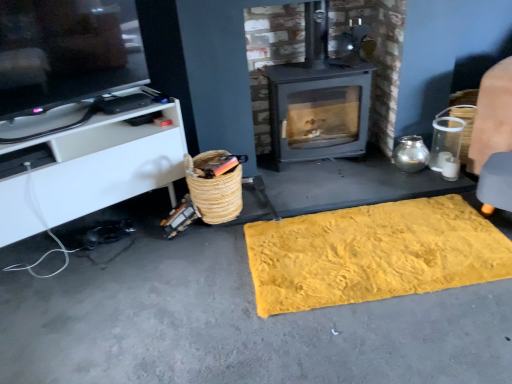
Describe the element at coordinates (237, 325) in the screenshot. This screenshot has height=384, width=512. I see `yellow textured rug at lower center` at that location.

The image size is (512, 384). Describe the element at coordinates (373, 253) in the screenshot. I see `yellow textured mat at center` at that location.

Measure the distance between point (421, 276) and camera.

Point (421, 276) and camera are 5.57 feet apart from each other.

In order to face woven straw basket at lower left, should I rotate leftwards or rightwards?

It's best to rotate left around 5.407 degrees.

What are the coordinates of `white matte cabinet at left` in the screenshot? It's located at (106, 162).

Where is `yellow textured rug at lower center`? yellow textured rug at lower center is located at coordinates (237, 325).

Considering the positions of objects matte gray wood burning stove at center and woven straw basket at lower left in the image provided, who is more to the right, matte gray wood burning stove at center or woven straw basket at lower left?

matte gray wood burning stove at center.

This screenshot has height=384, width=512. Find the location of `basket in front of the matte gray wood burning stove at center`. basket in front of the matte gray wood burning stove at center is located at coordinates (214, 189).

Is matte gray wood burning stove at center positioned with its back to woven straw basket at lower left?

No, matte gray wood burning stove at center is not facing the opposite direction of woven straw basket at lower left.

Who is smaller, matte gray wood burning stove at center or woven straw basket at lower left?

With smaller size is woven straw basket at lower left.

Does point (2, 103) come in front of point (344, 59)?

Yes, point (2, 103) is in front of point (344, 59).

Locate an element on the screen. Image resolution: width=512 pixels, height=384 pixels. television below the matte gray wood burning stove at center (from the image's perspective) is located at coordinates (65, 52).

Locate an element on the screen. basket behind the matte black tv at upper left is located at coordinates (214, 189).

Could you tell me if matte black tv at upper left is turned towards woven straw basket at lower left?

No, matte black tv at upper left is not oriented towards woven straw basket at lower left.

Considering the sizes of objects matte black tv at upper left and woven straw basket at lower left in the image provided, who is smaller, matte black tv at upper left or woven straw basket at lower left?

woven straw basket at lower left is smaller.

From a real-world perspective, who is located higher, matte black tv at upper left or woven straw basket at lower left?

In real-world perspective, matte black tv at upper left is above.

From a real-world perspective, is woven straw basket at lower left physically located above or below matte black tv at upper left?

woven straw basket at lower left is situated lower than matte black tv at upper left in the real world.

Looking at this image, from the image's perspective, is woven straw basket at lower left above or below matte black tv at upper left?

From the image's perspective, woven straw basket at lower left appears below matte black tv at upper left.

Is point (226, 219) positioned in front of point (27, 26)?

No, (226, 219) is further to viewer.

Which of these two, woven straw basket at lower left or matte black tv at upper left, stands shorter?

woven straw basket at lower left is shorter.

From the picture: Is white matte cabinet at left taller than woven straw basket at lower left?

Correct, white matte cabinet at left is much taller as woven straw basket at lower left.

Considering the relative positions of white matte cabinet at left and woven straw basket at lower left in the image provided, is white matte cabinet at left to the left or to the right of woven straw basket at lower left?

Based on their positions, white matte cabinet at left is located to the left of woven straw basket at lower left.

Is white matte cabinet at left bigger or smaller than woven straw basket at lower left?

Clearly, white matte cabinet at left is larger in size than woven straw basket at lower left.

Is point (25, 176) closer or farther from the camera than point (213, 206)?

Point (25, 176).

Which object is positioned more to the left, white matte cabinet at left or yellow textured mat at center?

white matte cabinet at left is more to the left.

Is yellow textured mat at center a part of white matte cabinet at left?

No, yellow textured mat at center is located outside of white matte cabinet at left.

Locate an element on the screen. The image size is (512, 384). mat on the right side of white matte cabinet at left is located at coordinates (373, 253).

From the image's perspective, which is below, white matte cabinet at left or yellow textured mat at center?

yellow textured mat at center appears lower in the image.

From a real-world perspective, is matte gray wood burning stove at center positioned under white matte cabinet at left based on gravity?

Incorrect, from a real-world perspective, matte gray wood burning stove at center is higher than white matte cabinet at left.

Considering the sizes of matte gray wood burning stove at center and white matte cabinet at left in the image, is matte gray wood burning stove at center taller or shorter than white matte cabinet at left?

Clearly, matte gray wood burning stove at center is taller compared to white matte cabinet at left.

Can you tell me how much matte gray wood burning stove at center and white matte cabinet at left differ in facing direction?

32.4 degrees.

Who is more distant, matte gray wood burning stove at center or white matte cabinet at left?

matte gray wood burning stove at center is behind.

Where is `wood burning stove on the right of woven straw basket at lower left`? The image size is (512, 384). wood burning stove on the right of woven straw basket at lower left is located at coordinates (320, 96).

Image resolution: width=512 pixels, height=384 pixels. Identify the location of wood burning stove behind the matte black tv at upper left. (320, 96).

Looking at the image, which one is located further to white matte cabinet at left, yellow textured mat at center or yellow textured rug at lower center?

The object further to white matte cabinet at left is yellow textured mat at center.

When comparing their distances from yellow textured mat at center, does yellow textured rug at lower center or white matte cabinet at left seem closer?

Based on the image, yellow textured rug at lower center appears to be nearer to yellow textured mat at center.

Which object lies nearer to the anchor point matte black tv at upper left, matte gray wood burning stove at center or white matte cabinet at left?

white matte cabinet at left is positioned closer to the anchor matte black tv at upper left.

Which object lies nearer to the anchor point matte black tv at upper left, yellow textured mat at center or yellow textured rug at lower center?

Based on the image, yellow textured rug at lower center appears to be nearer to matte black tv at upper left.

When comparing their distances from white matte cabinet at left, does yellow textured mat at center or woven straw basket at lower left seem further?

yellow textured mat at center is further to white matte cabinet at left.

Based on their spatial positions, is yellow textured rug at lower center or woven straw basket at lower left closer to white matte cabinet at left?

Based on the image, woven straw basket at lower left appears to be nearer to white matte cabinet at left.

Which object lies nearer to the anchor point matte gray wood burning stove at center, matte black tv at upper left or woven straw basket at lower left?

woven straw basket at lower left.

Estimate the real-world distances between objects in this image. Which object is further from yellow textured mat at center, matte gray wood burning stove at center or yellow textured rug at lower center?

matte gray wood burning stove at center.

The image size is (512, 384). Identify the location of basket located between matte black tv at upper left and yellow textured rug at lower center in the left-right direction. tap(214, 189).

I want to click on television between white matte cabinet at left and yellow textured rug at lower center in the horizontal direction, so click(x=65, y=52).

This screenshot has height=384, width=512. I want to click on television between white matte cabinet at left and matte gray wood burning stove at center in the horizontal direction, so click(x=65, y=52).

Locate an element on the screen. basket situated between white matte cabinet at left and yellow textured rug at lower center from left to right is located at coordinates (214, 189).